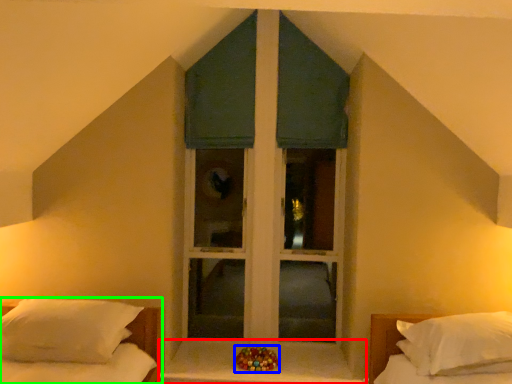
Question: Considering the real-world distances, which object is farthest from window sill (highlighted by a red box)? miniature (highlighted by a blue box) or bed (highlighted by a green box)?

Choices:
 (A) miniature
 (B) bed

Answer: (B)